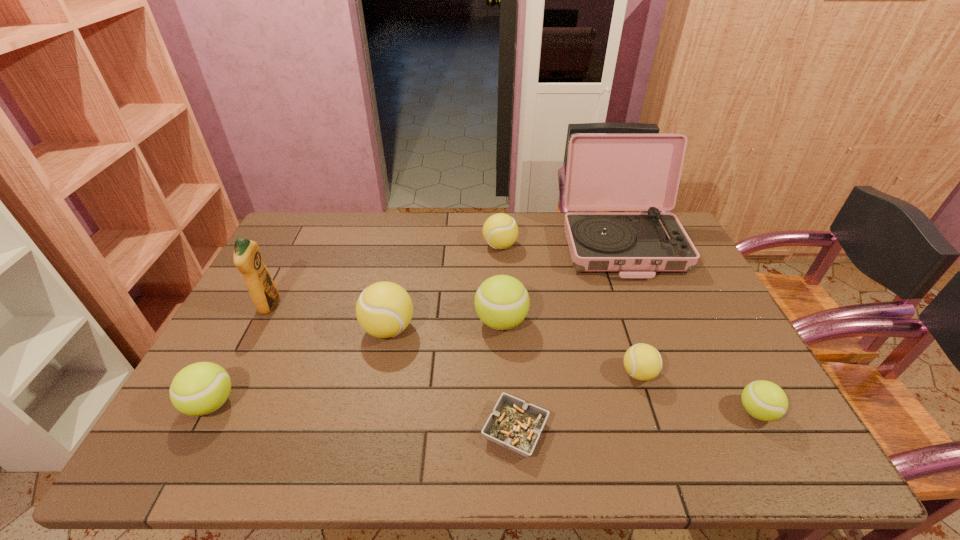
You are a GUI agent. You are given a task and a screenshot of the screen. Output one action in this format:
    pyautogui.click(x=<x>, y=<y>)
    Task: Click on the free location located 0.210m on the right of the farthest tennis ball
    This screenshot has width=960, height=540.
    Given the screenshot: What is the action you would take?
    pyautogui.click(x=579, y=246)

Find the location of a particular element. free space located on the front of the leftmost tennis ball is located at coordinates (179, 465).

The width and height of the screenshot is (960, 540). Find the location of `vacant area situated 0.070m on the back of the rightmost green tennis ball`. vacant area situated 0.070m on the back of the rightmost green tennis ball is located at coordinates (735, 372).

The width and height of the screenshot is (960, 540). I want to click on vacant space located on the left of the nearest yellow tennis ball, so click(x=577, y=373).

Locate an element on the screen. This screenshot has width=960, height=540. free point located 0.180m on the right of the shortest object is located at coordinates (630, 430).

Where is `record player positioned at the far edge`? record player positioned at the far edge is located at coordinates (605, 171).

Find the location of a particular element. tennis ball that is at the far edge is located at coordinates click(x=500, y=231).

The width and height of the screenshot is (960, 540). What are the coordinates of `tennis ball present at the near edge` in the screenshot? It's located at (764, 400).

You are a GUI agent. You are given a task and a screenshot of the screen. Output one action in this format:
    pyautogui.click(x=<x>, y=<y>)
    Task: Click on the ashtray that is positioned at the near edge
    The height and width of the screenshot is (540, 960).
    Given the screenshot: What is the action you would take?
    pos(514,424)

Where is `detergent that is at the left edge`? The height and width of the screenshot is (540, 960). detergent that is at the left edge is located at coordinates (263, 291).